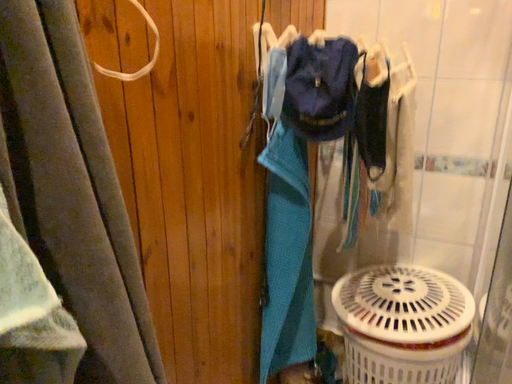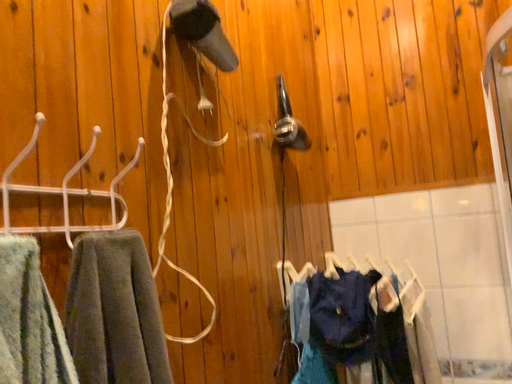
Question: Which way did the camera rotate in the video?

Choices:
 (A) rotated upward
 (B) rotated downward

Answer: (A)